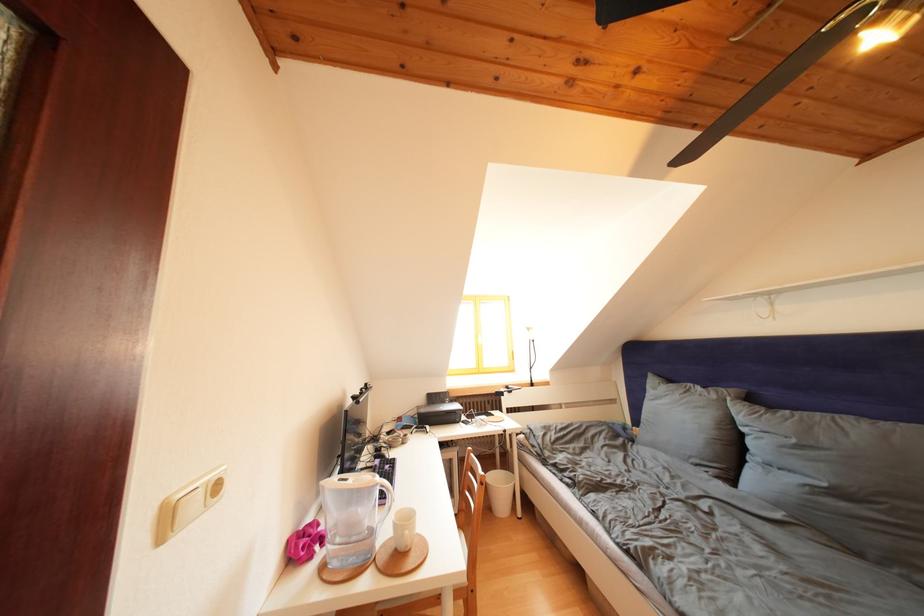
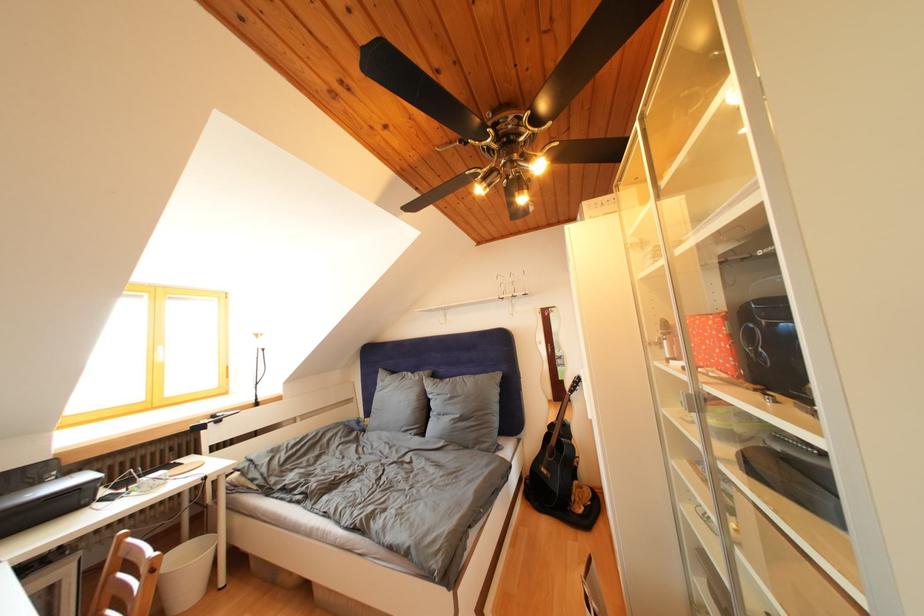
The point at (451, 407) is marked in the first image. Where is the corresponding point in the second image?

(44, 488)